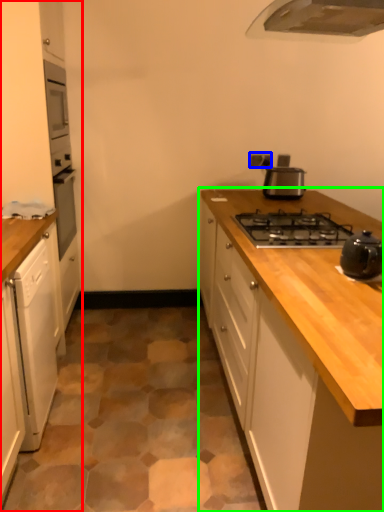
Question: Which object is positioned closest to cabinetry (highlighted by a red box)? Select from electric outlet (highlighted by a blue box) and cabinetry (highlighted by a green box).

Choices:
 (A) electric outlet
 (B) cabinetry

Answer: (B)